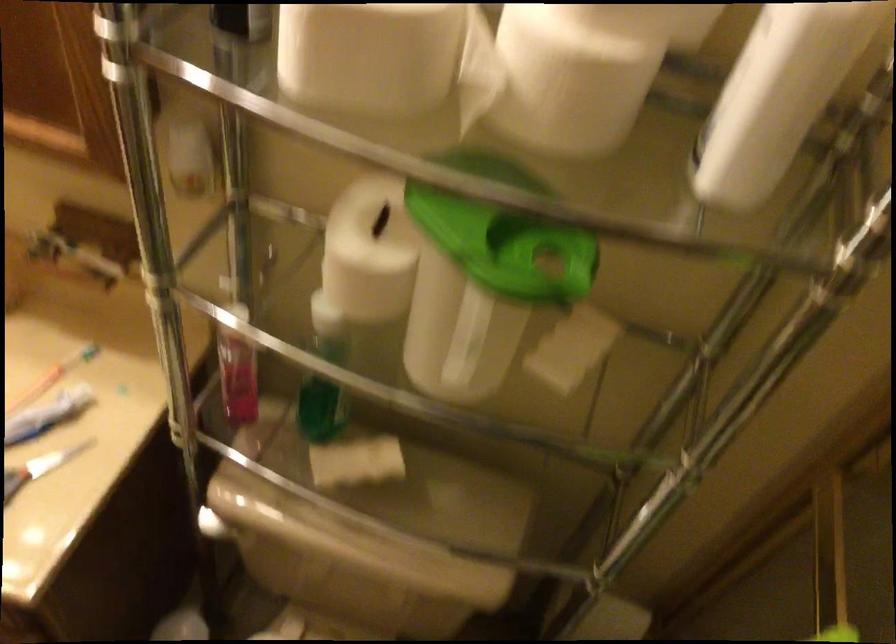
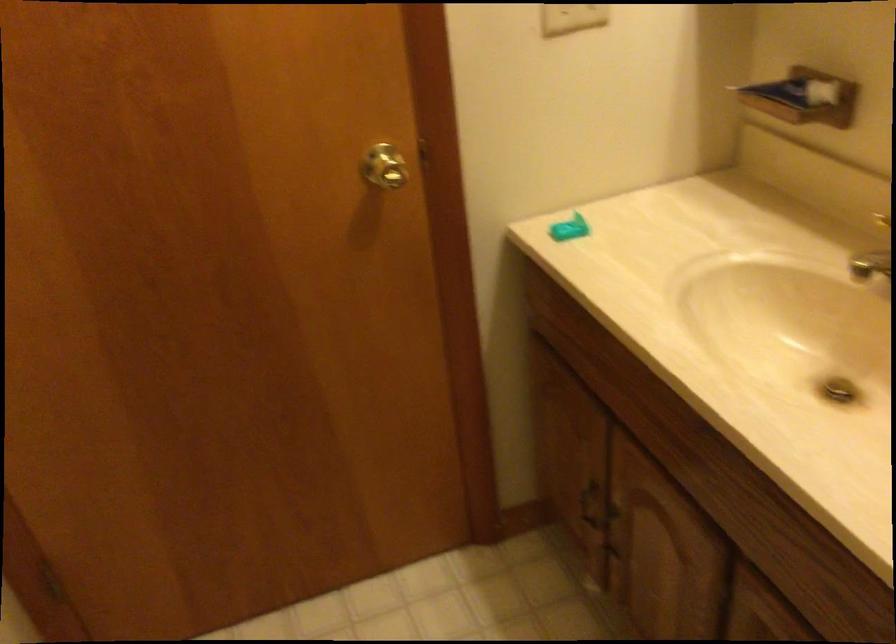
Question: The first image is from the beginning of the video and the second image is from the end. How did the camera likely rotate when shooting the video?

Choices:
 (A) Left
 (B) Right
 (C) Up
 (D) Down

Answer: (A)